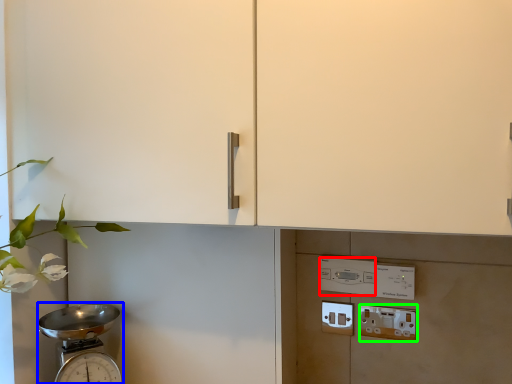
Question: Which object is the closest to the light switch (highlighted by a red box)? Choose among these: scale (highlighted by a blue box) or electric outlet (highlighted by a green box).

Choices:
 (A) scale
 (B) electric outlet

Answer: (B)